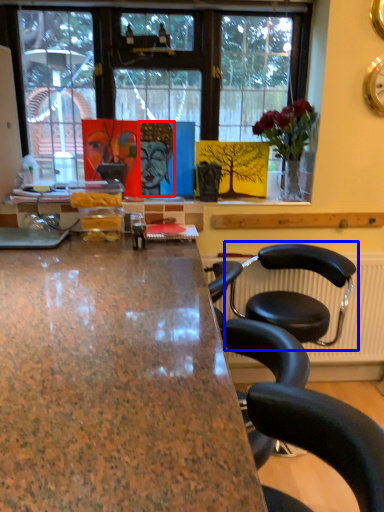
Question: Which point is closer to the camera, person (highlighted by a red box) or chair (highlighted by a blue box)?

Choices:
 (A) person
 (B) chair

Answer: (B)